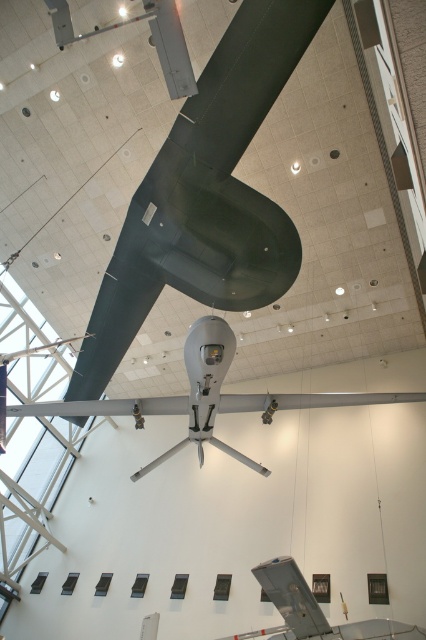
Question: Can you confirm if silver metallic drone at center is positioned to the right of metallic gray airplane at lower center?

Choices:
 (A) yes
 (B) no

Answer: (B)

Question: Does silver metallic drone at center have a smaller size compared to metallic gray airplane at lower center?

Choices:
 (A) no
 (B) yes

Answer: (B)

Question: Which object appears closest to the camera in this image?

Choices:
 (A) silver metallic drone at center
 (B) metallic gray airplane at lower center

Answer: (A)

Question: Among these objects, which one is nearest to the camera?

Choices:
 (A) silver metallic drone at center
 (B) metallic gray airplane at lower center

Answer: (A)

Question: Which of the following is the farthest from the observer?

Choices:
 (A) (287, 596)
 (B) (262, 403)

Answer: (A)

Question: Does silver metallic drone at center appear over metallic gray airplane at lower center?

Choices:
 (A) no
 (B) yes

Answer: (B)